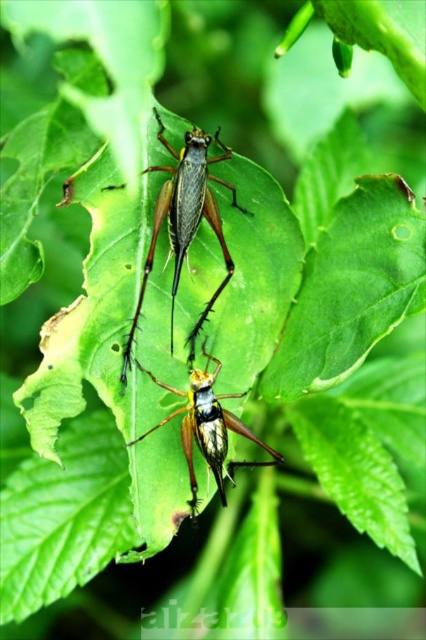
You are an entomologist observing two insects on a leaf. You notice their positions marked as point A at point [161,195] and point B at point [192,467]. Based on their spatial relationship, which point is closer to the viewer?

Point B at point [192,467] is closer to the viewer because the description states that point A is behind point B.

You are a scientist observing two grasshoppers on a leaf. You need to determine if they are close enough to communicate through vibrations. The minimum distance required for such communication is 8 inches. Are the shiny green grasshopper at center and the shiny metallic grasshopper at center within this distance?

The shiny green grasshopper at center and the shiny metallic grasshopper at center are 8.39 inches apart, which is slightly more than the 8 inches required for communication through vibrations. Therefore, they are not within the required distance.